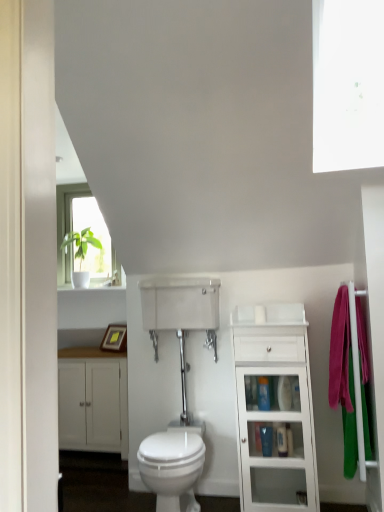
Question: Considering the positions of transparent glass window screen at upper right and blue plastic bottle at center, the third toiletry from the top, in the image, is transparent glass window screen at upper right bigger or smaller than blue plastic bottle at center, the third toiletry from the top,?

Choices:
 (A) small
 (B) big

Answer: (B)

Question: From the image's perspective, is transparent glass window screen at upper right positioned above or below blue plastic bottle at center, the third toiletry from the top?

Choices:
 (A) below
 (B) above

Answer: (B)

Question: Which object is the closest to the white glossy medicine cabinet at center?

Choices:
 (A) white glossy bidet at center
 (B) pink fabric towel at right
 (C) blue glossy toiletry at center, which appears as the 1th toiletry when viewed from the top
 (D) blue plastic bottle at center, which is the first toiletry from bottom to top
 (E) transparent glass window screen at upper right

Answer: (C)

Question: Which is farther from the blue plastic bottle at center, the second toiletry positioned from the bottom?

Choices:
 (A) white matte cabinet at lower left, placed as the 2th bathroom cabinet when sorted from front to back
 (B) pink fabric towel at right
 (C) white glossy cabinet at right, which appears as the second bathroom cabinet when viewed from the left
 (D) blue plastic bottle at center, which is the first toiletry from bottom to top
 (E) transparent glass window screen at upper right

Answer: (E)